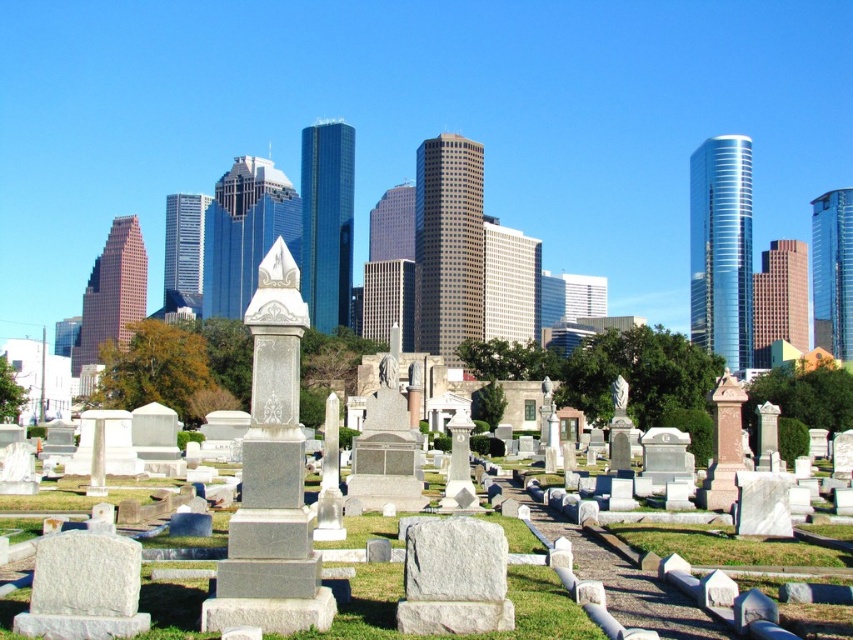
Is green grass at center above gray stone gravestone at center?

Incorrect, green grass at center is not positioned above gray stone gravestone at center.

Which of these two, green grass at center or gray stone gravestone at center, stands taller?

green grass at center

Who is more distant from viewer, (582, 577) or (459, 554)?

Point (582, 577)

Identify the location of green grass at center. The image size is (853, 640). pos(631,588).